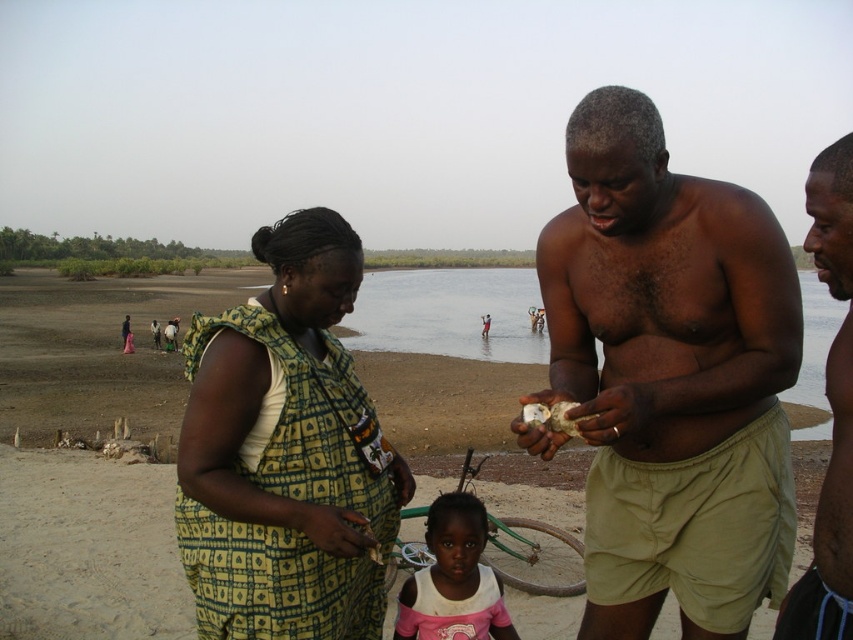
Question: Is sandy beach at center positioned in front of green printed fabric dress at left?

Choices:
 (A) no
 (B) yes

Answer: (A)

Question: From the image, what is the correct spatial relationship of skinny tan torso at center in relation to sandy beach at center?

Choices:
 (A) right
 (B) left

Answer: (B)

Question: Where is skinny tan torso at center located in relation to green printed fabric dress at left in the image?

Choices:
 (A) below
 (B) above

Answer: (B)

Question: Which object is closer to the camera taking this photo?

Choices:
 (A) sandy beach at center
 (B) shiny black skin at center
 (C) skinny tan torso at center

Answer: (B)

Question: Estimate the real-world distances between objects in this image. Which object is closer to the pink cotton shirt at center?

Choices:
 (A) skinny tan torso at center
 (B) green printed fabric dress at left
 (C) shiny black skin at center
 (D) sandy beach at center

Answer: (B)

Question: Which object is the farthest from the sandy beach at center?

Choices:
 (A) shiny black skin at center
 (B) green printed fabric dress at left

Answer: (A)